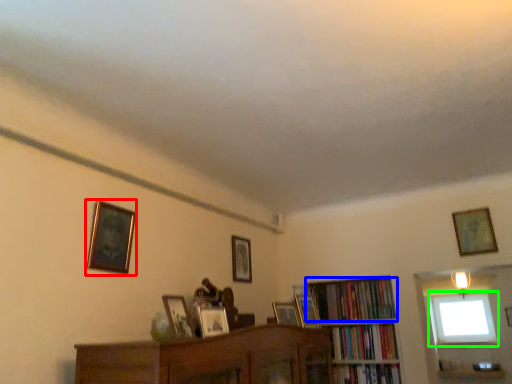
Question: Which is farther away from picture frame (highlighted by a red box)? book (highlighted by a blue box) or window (highlighted by a green box)?

Choices:
 (A) book
 (B) window

Answer: (B)